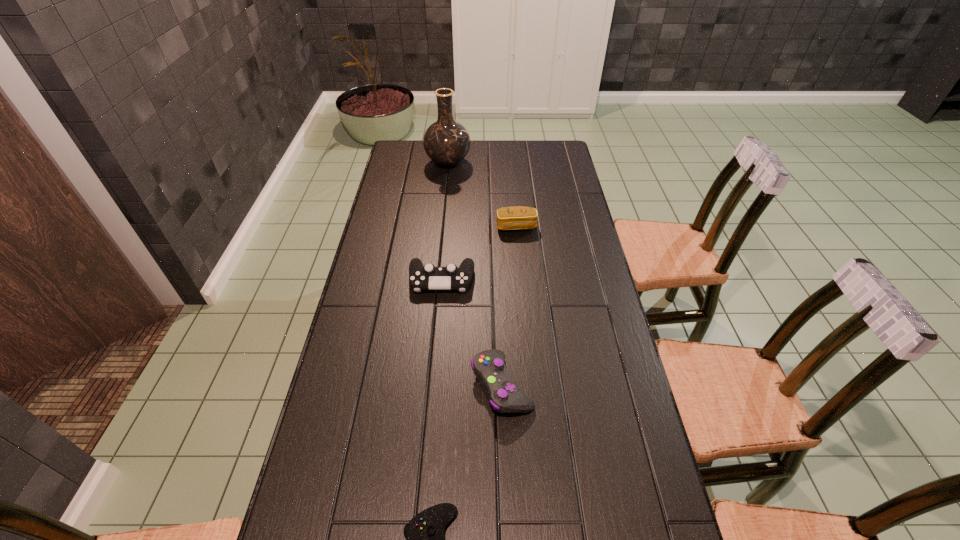
Locate an element on the screen. The width and height of the screenshot is (960, 540). the farthest object is located at coordinates (446, 142).

I want to click on the tallest object, so click(446, 142).

Find the location of a particular element. The image size is (960, 540). the farthest control is located at coordinates [428, 277].

In order to click on the second farthest object in this screenshot , I will do `click(517, 217)`.

The height and width of the screenshot is (540, 960). Identify the location of the fourth farthest object. [x=504, y=395].

What are the coordinates of `vacant region located on the front of the tallest object` in the screenshot? It's located at (443, 215).

The width and height of the screenshot is (960, 540). Find the location of `vacant space located on the surface of the farthest control`. vacant space located on the surface of the farthest control is located at coordinates (431, 401).

This screenshot has height=540, width=960. I want to click on free space located on the zipper side of the clutch bag, so pos(521,275).

Where is `free space located 0.320m on the back of the second farthest control`? This screenshot has height=540, width=960. free space located 0.320m on the back of the second farthest control is located at coordinates (497, 273).

This screenshot has width=960, height=540. In order to click on object at the far edge in this screenshot , I will do `click(446, 142)`.